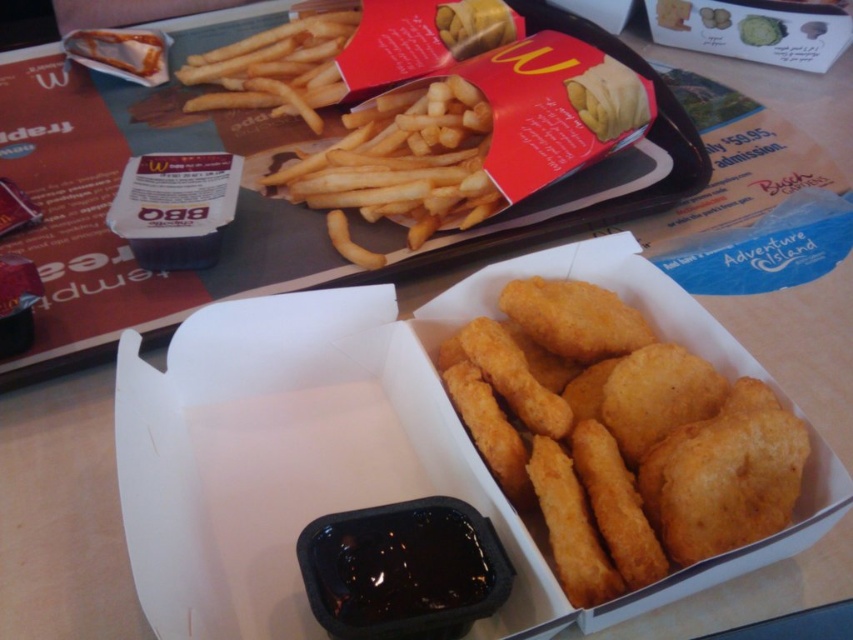
Can you confirm if golden crispy fries at upper center is shorter than golden crispy french fries at upper center?

No, golden crispy fries at upper center is not shorter than golden crispy french fries at upper center.

Where is `golden crispy fries at upper center`? This screenshot has height=640, width=853. golden crispy fries at upper center is located at coordinates (401, 166).

I want to click on golden crispy fries at upper center, so click(x=401, y=166).

Is point (508, 400) positioned behind point (338, 33)?

No, it is not.

Can you confirm if golden fried nuggets at center is thinner than golden crispy french fries at upper center?

Yes, golden fried nuggets at center is thinner than golden crispy french fries at upper center.

Between point (456, 378) and point (233, 74), which one is positioned behind?

Positioned behind is point (233, 74).

Where is `golden fried nuggets at center`? This screenshot has height=640, width=853. golden fried nuggets at center is located at coordinates (619, 436).

Based on the photo, which is above, golden fried nuggets at center or golden crispy fries at upper center?

golden crispy fries at upper center

Is golden fried nuggets at center smaller than golden crispy fries at upper center?

Indeed, golden fried nuggets at center has a smaller size compared to golden crispy fries at upper center.

Where is `golden fried nuggets at center`? golden fried nuggets at center is located at coordinates (619, 436).

You are a GUI agent. You are given a task and a screenshot of the screen. Output one action in this format:
    pyautogui.click(x=<x>, y=<y>)
    Task: Click on the golden fried nuggets at center
    The image size is (853, 640).
    Given the screenshot: What is the action you would take?
    pyautogui.click(x=619, y=436)